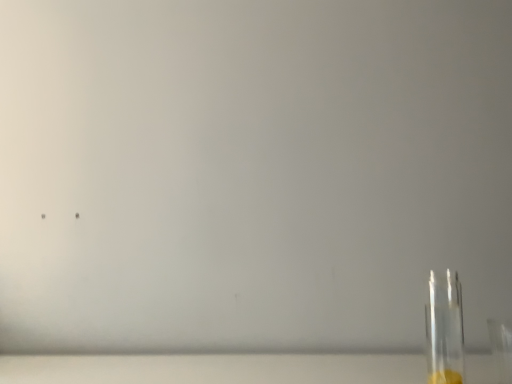
You are a GUI agent. You are given a task and a screenshot of the screen. Output one action in this format:
    pyautogui.click(x=<x>, y=<y>)
    Task: Click on the transparent glass table at lower right
    The image size is (512, 384).
    Given the screenshot: What is the action you would take?
    pyautogui.click(x=216, y=369)

The width and height of the screenshot is (512, 384). Describe the element at coordinates (216, 369) in the screenshot. I see `transparent glass table at lower right` at that location.

Measure the distance between transparent glass table at lower right and camera.

The depth of transparent glass table at lower right is 80.91 centimeters.

This screenshot has width=512, height=384. Describe the element at coordinates (445, 330) in the screenshot. I see `transparent glass bottle at right` at that location.

At what (x,y) coordinates should I click in order to perform the action: click on transparent glass bottle at right. Please return your answer as a coordinate pair (x, y). The width and height of the screenshot is (512, 384). Looking at the image, I should click on (445, 330).

Locate an element on the screen. transparent glass table at lower right is located at coordinates coord(216,369).

Is transparent glass table at lower right at the left side of transparent glass bottle at right?

Correct, you'll find transparent glass table at lower right to the left of transparent glass bottle at right.

Is the position of transparent glass table at lower right more distant than that of transparent glass bottle at right?

Yes, transparent glass table at lower right is further from the viewer.

Considering the positions of points (406, 373) and (430, 273), is point (406, 373) farther from camera compared to point (430, 273)?

No, (406, 373) is closer to viewer.

From the image's perspective, between transparent glass table at lower right and transparent glass bottle at right, which one is located above?

transparent glass bottle at right appears higher in the image.

From a real-world perspective, which is physically below, transparent glass table at lower right or transparent glass bottle at right?

transparent glass table at lower right.

Looking at their sizes, would you say transparent glass table at lower right is wider or thinner than transparent glass bottle at right?

Clearly, transparent glass table at lower right has more width compared to transparent glass bottle at right.

From their relative heights in the image, would you say transparent glass table at lower right is taller or shorter than transparent glass bottle at right?

transparent glass table at lower right is shorter than transparent glass bottle at right.

Is transparent glass table at lower right bigger or smaller than transparent glass bottle at right?

Clearly, transparent glass table at lower right is larger in size than transparent glass bottle at right.

Is transparent glass table at lower right located outside transparent glass bottle at right?

Indeed, transparent glass table at lower right is completely outside transparent glass bottle at right.

Is transparent glass table at lower right touching transparent glass bottle at right?

No, transparent glass table at lower right is not touching transparent glass bottle at right.

In the scene shown: Could you tell me if transparent glass table at lower right is turned towards transparent glass bottle at right?

No.

How many degrees apart are the facing directions of transparent glass table at lower right and transparent glass bottle at right?

There is a 4.25-degree angle between the facing directions of transparent glass table at lower right and transparent glass bottle at right.

Locate an element on the screen. The image size is (512, 384). bottle above the transparent glass table at lower right (from the image's perspective) is located at coordinates (445, 330).

Which object is positioned more to the left, transparent glass bottle at right or transparent glass table at lower right?

transparent glass table at lower right is more to the left.

Is transparent glass bottle at right closer to the viewer compared to transparent glass table at lower right?

Yes.

Considering the points (452, 360) and (197, 364), which point is behind, point (452, 360) or point (197, 364)?

The point (452, 360) is farther from the camera.

From the image's perspective, which one is positioned lower, transparent glass bottle at right or transparent glass table at lower right?

transparent glass table at lower right.

From a real-world perspective, relative to transparent glass table at lower right, is transparent glass bottle at right vertically above or below?

Clearly, from a real-world perspective, transparent glass bottle at right is above transparent glass table at lower right.

In terms of width, does transparent glass bottle at right look wider or thinner when compared to transparent glass table at lower right?

Clearly, transparent glass bottle at right has less width compared to transparent glass table at lower right.

Between transparent glass bottle at right and transparent glass table at lower right, which one has less height?

transparent glass table at lower right.

In terms of size, does transparent glass bottle at right appear bigger or smaller than transparent glass table at lower right?

transparent glass bottle at right is smaller than transparent glass table at lower right.

Is transparent glass table at lower right a part of transparent glass bottle at right?

No, transparent glass table at lower right is not a part of transparent glass bottle at right.

Is transparent glass bottle at right far from transparent glass table at lower right?

That's not correct — transparent glass bottle at right is a little close to transparent glass table at lower right.

Could you tell me if transparent glass bottle at right is turned towards transparent glass table at lower right?

No, transparent glass bottle at right is not facing towards transparent glass table at lower right.

Based on the photo, can you tell me how much transparent glass bottle at right and transparent glass table at lower right differ in facing direction?

4.25 degrees separate the facing orientations of transparent glass bottle at right and transparent glass table at lower right.

Measure the distance from transparent glass bottle at right to transparent glass table at lower right.

transparent glass bottle at right and transparent glass table at lower right are 22.68 centimeters apart.

Find the location of a particular element. table top on the left of transparent glass bottle at right is located at coordinates (216, 369).

This screenshot has height=384, width=512. Find the location of `bottle that is above the transparent glass table at lower right (from the image's perspective)`. bottle that is above the transparent glass table at lower right (from the image's perspective) is located at coordinates (445, 330).

I want to click on bottle that is on the right side of transparent glass table at lower right, so click(x=445, y=330).